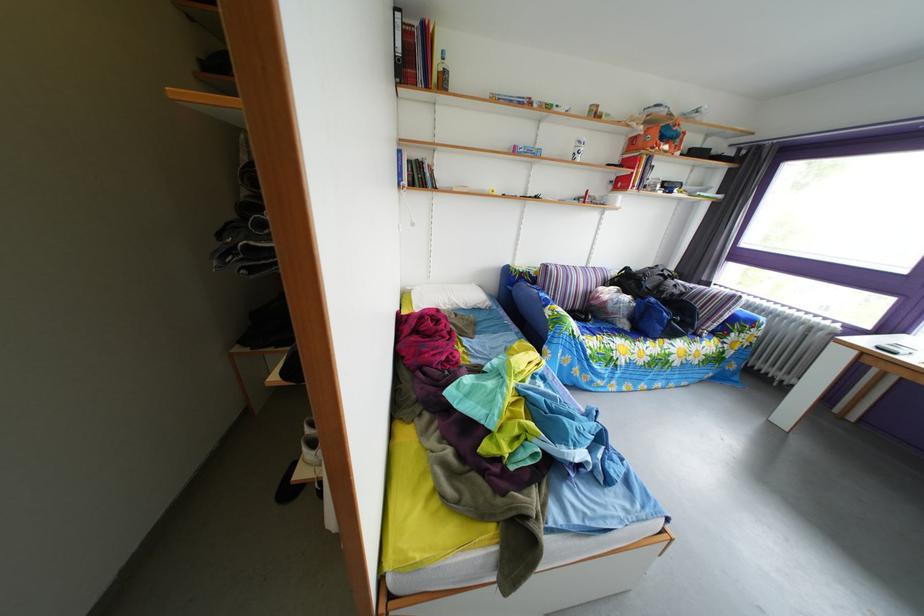
Where would you lift the white cup? Please return your answer as a coordinate pair (x, y).

(578, 148)